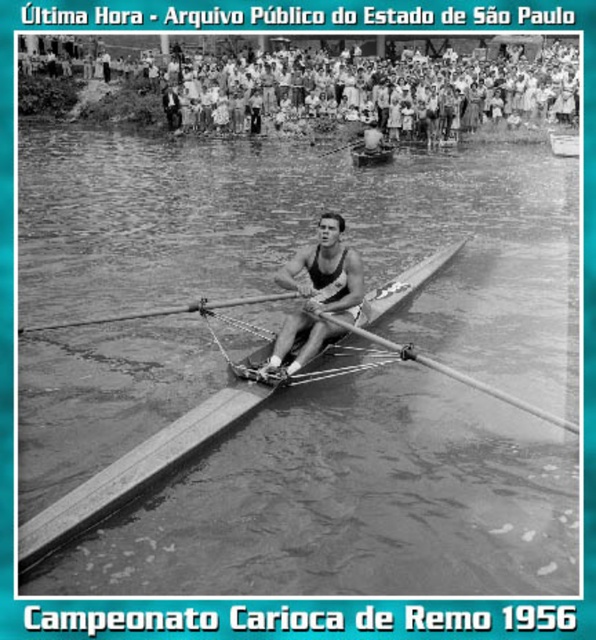
Is the position of clear water at center more distant than that of wooden smooth oar at center?

No, clear water at center is in front of wooden smooth oar at center.

Is clear water at center in front of wooden smooth oar at center?

Yes, clear water at center is closer to the viewer.

Which is behind, point (156, 516) or point (344, 321)?

The point (344, 321) is more distant.

Identify the location of clear water at center. (311, 230).

What do you see at coordinates (311, 230) in the screenshot? Image resolution: width=596 pixels, height=640 pixels. I see `clear water at center` at bounding box center [311, 230].

Is point (105, 266) closer to camera compared to point (312, 333)?

No.

The image size is (596, 640). What are the coordinates of `clear water at center` in the screenshot? It's located at (311, 230).

Which is more to the right, wooden canoe at center or smooth wood boat at center?

smooth wood boat at center is more to the right.

Can you confirm if wooden canoe at center is bigger than smooth wood boat at center?

No.

What do you see at coordinates (371, 156) in the screenshot? The width and height of the screenshot is (596, 640). I see `wooden canoe at center` at bounding box center [371, 156].

Identify the location of wooden canoe at center. click(371, 156).